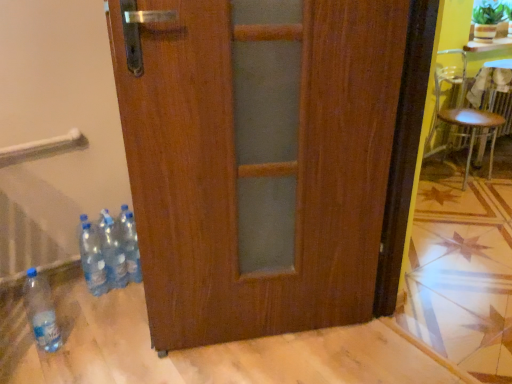
Image resolution: width=512 pixels, height=384 pixels. Identify the location of vacant space that's between transparent plastic bottle at lower left, which is the 1th bottle from left to right, and translucent plastic bottles at lower left, the second bottle when ordered from right to left. (86, 314).